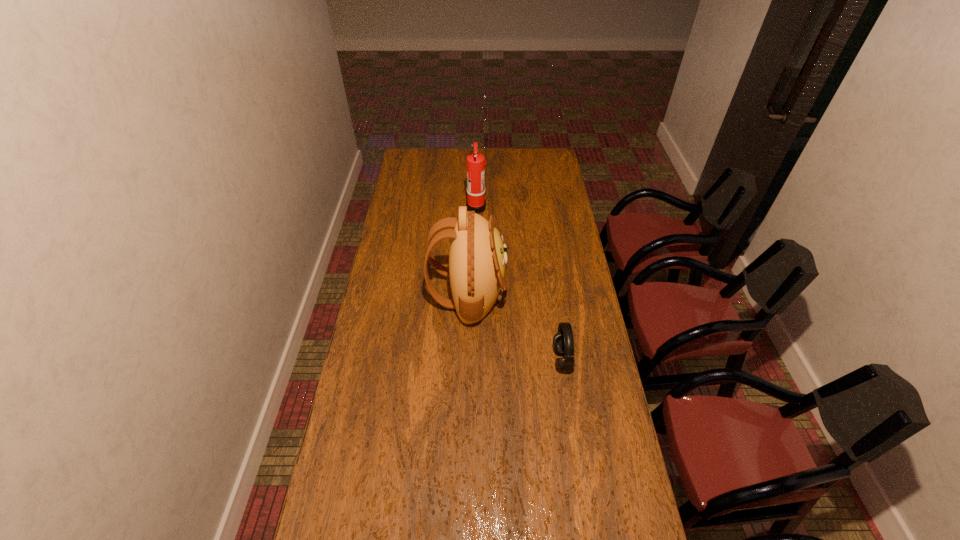
Where is `the second farthest object`? This screenshot has width=960, height=540. the second farthest object is located at coordinates (477, 270).

The width and height of the screenshot is (960, 540). I want to click on the farthest object, so click(x=475, y=161).

Where is `the third shortest object`? This screenshot has height=540, width=960. the third shortest object is located at coordinates (475, 161).

The width and height of the screenshot is (960, 540). What are the coordinates of `the second nearest object` in the screenshot? It's located at (563, 343).

Where is `free space located on the front-facing side of the second farthest object`? This screenshot has width=960, height=540. free space located on the front-facing side of the second farthest object is located at coordinates (581, 293).

Find the location of a particular element. The width and height of the screenshot is (960, 540). vacant space located at the nozzle of the farthest object is located at coordinates (564, 207).

This screenshot has height=540, width=960. Find the location of `vacant region located on the earcups of the headset`. vacant region located on the earcups of the headset is located at coordinates (468, 359).

Identify the location of vacant space located 0.200m on the earcups of the headset. (499, 359).

Identify the location of vacant space situated on the earcups of the headset. (471, 359).

Image resolution: width=960 pixels, height=540 pixels. Identify the location of object located at the right edge. (563, 343).